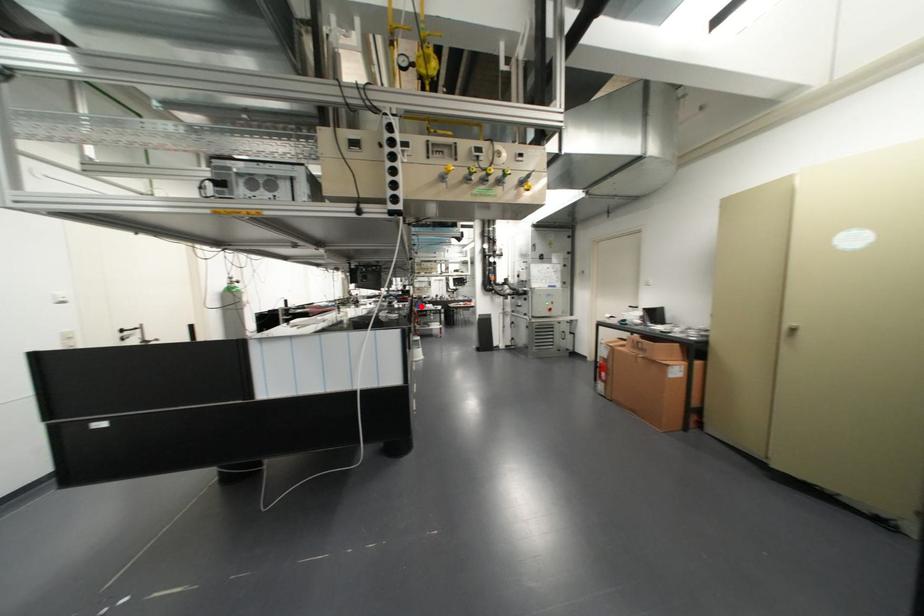
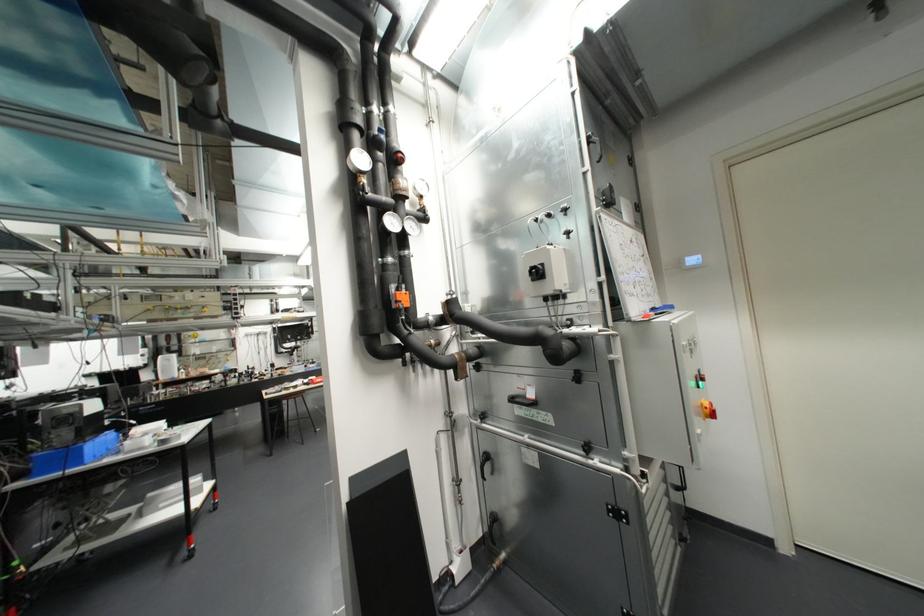
Question: I am providing you with two images of the same scene from different viewpoints. A red point is marked on the first image. Can you still see the location of the red point in image 2?

Choices:
 (A) Yes
 (B) No

Answer: (A)